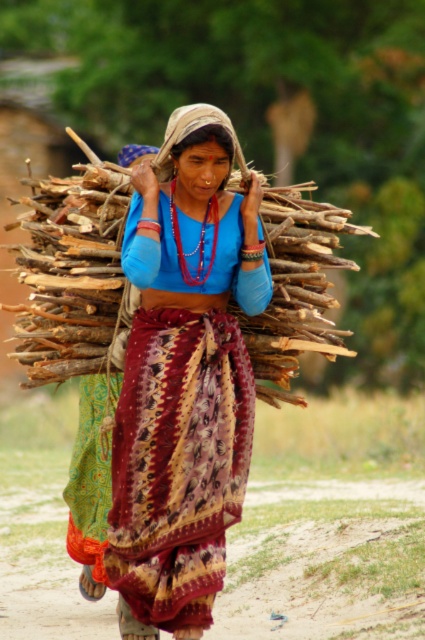
You are a photographer trying to capture the woman in the scene. You want to focus on the matte blue blouse at center and the wooden sticks at center. Which object should you adjust your camera focus on first to ensure both are in the frame?

The matte blue blouse at center is closer to the viewer than the wooden sticks at center, so you should focus on the matte blue blouse at center first to ensure both are in the frame.

The woman in the scene is carrying a bundle of firewood on her shoulders. Considering the wooden sticks at center and the matte blue shirt at center, which object is taller?

The wooden sticks at center are much taller than the matte blue shirt at center.

You are a fashion designer observing the woman in the scene. You notice both a matte blue blouse at center and a matte blue shirt at center. Which one is wider?

The matte blue blouse at center is wider than the matte blue shirt at center according to the description.